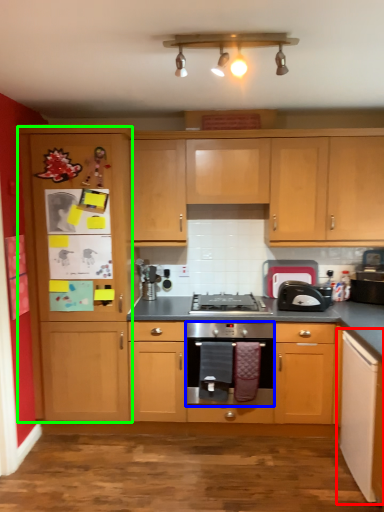
Question: Which object is the farthest from cabinetry (highlighted by a red box)? Choose among these: oven (highlighted by a blue box) or file cabinet (highlighted by a green box).

Choices:
 (A) oven
 (B) file cabinet

Answer: (B)